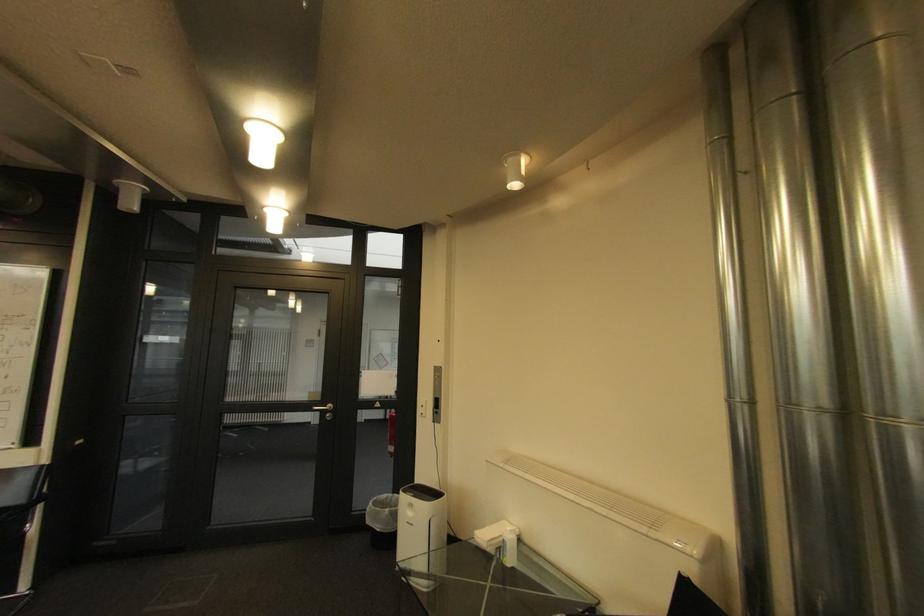
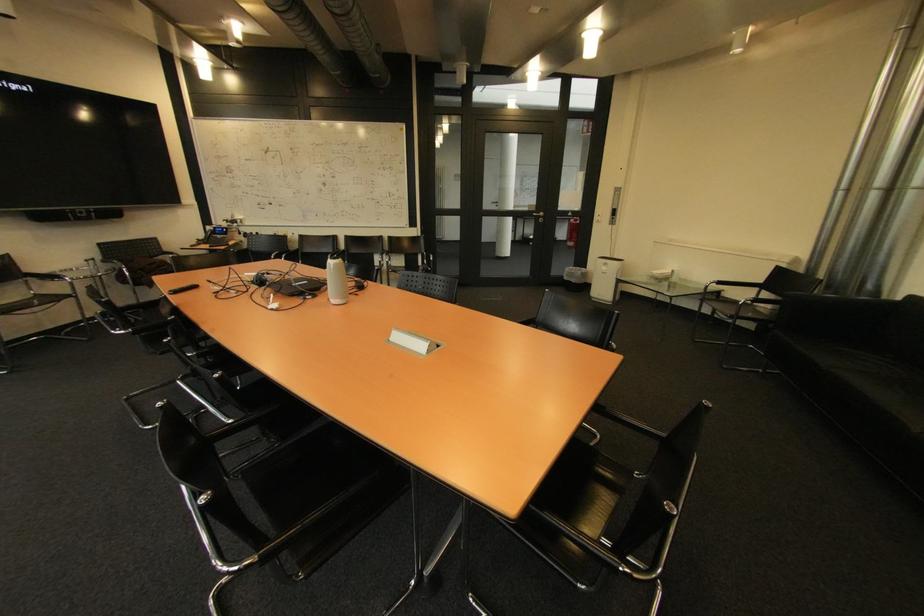
Where in the second image is the point corresponding to point (326, 400) from the first image?

(542, 209)